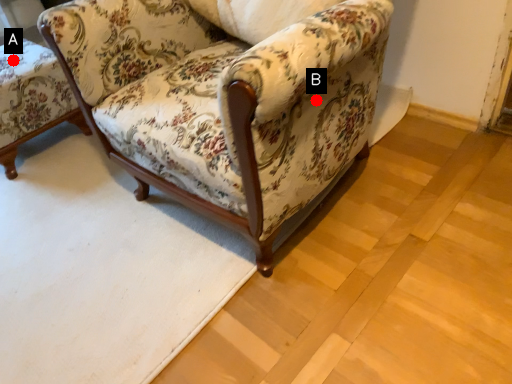
Question: Two points are circled on the image, labeled by A and B beside each circle. Which of the following is the farthest from the observer?

Choices:
 (A) A is further
 (B) B is further

Answer: (A)